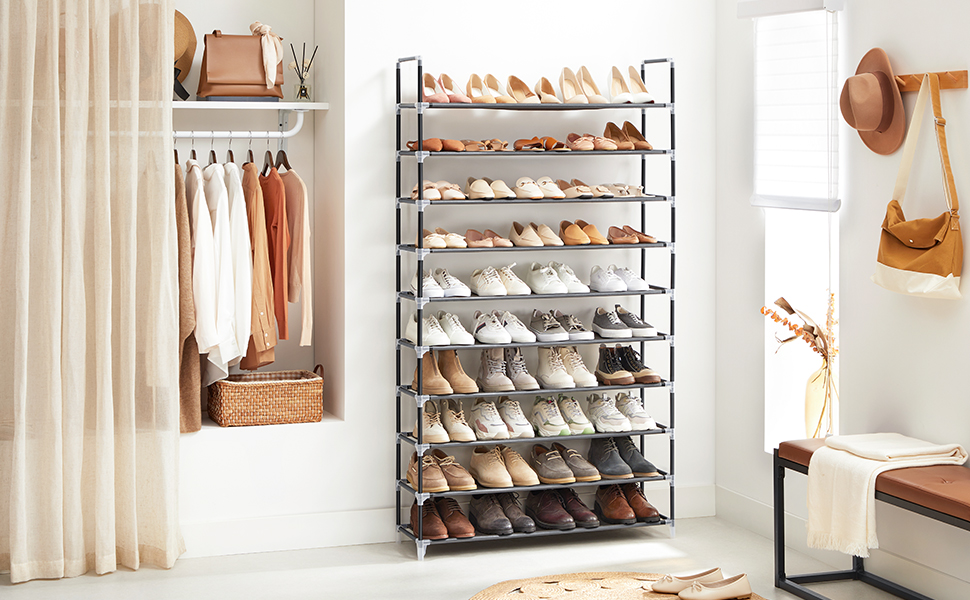
You are a GUI agent. You are given a task and a screenshot of the screen. Output one action in this format:
    pyautogui.click(x=<x>, y=<y>)
    Task: Click on the rifts in curtain left
    The image size is (970, 600).
    Given the screenshot: What is the action you would take?
    pyautogui.click(x=16, y=66), pyautogui.click(x=43, y=96), pyautogui.click(x=75, y=117), pyautogui.click(x=102, y=144), pyautogui.click(x=121, y=156), pyautogui.click(x=163, y=183)